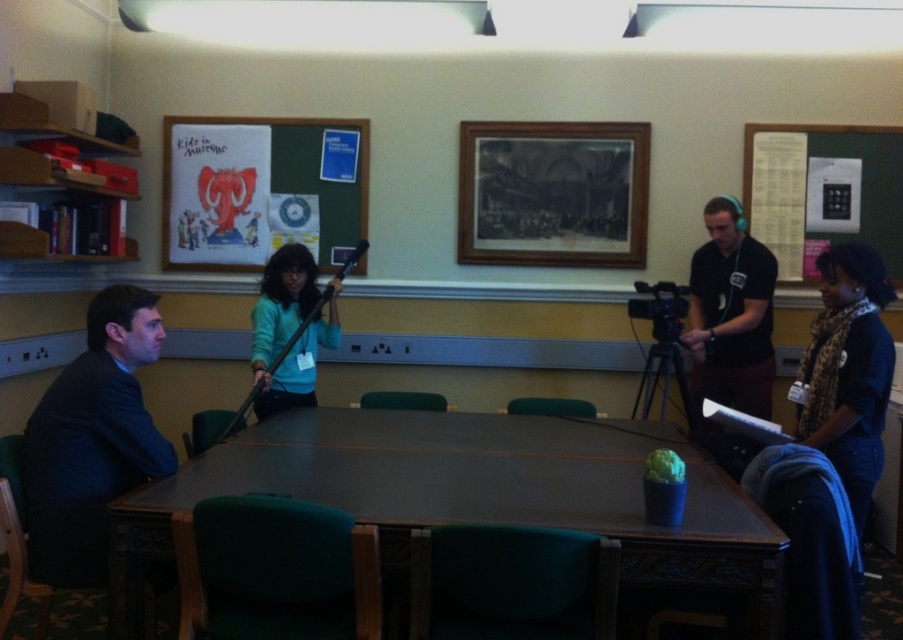
You are organizing a presentation in the conference room and need to place a laptop between the wooden framed print at upper center and the black matte headphones at upper right. The laptop requires 30 centimeters of space. Can you fit it there?

The wooden framed print at upper center is 83.38 centimeters away from the black matte headphones at upper right, so yes, the laptop can be placed between them as there is sufficient space.

You are organizing a presentation and need to place a 1.2 meter wide screen between the wooden framed print at upper center and the teal matte sweater at center. Can the space between them accommodate the screen?

The wooden framed print at upper center might be wider than the teal matte sweater at center, but without exact measurements of the distance between them, it is uncertain if the 1.2 meter wide screen can fit. Additional information is needed to determine the feasibility.

You are organizing a presentation and need to place your white paperboard at upper right and black matte headphones at upper right in a way that they are visible to the audience. Given their positions, which object is higher up on the wall?

The white paperboard at upper right is positioned above the black matte headphones at upper right, so it is higher up on the wall.